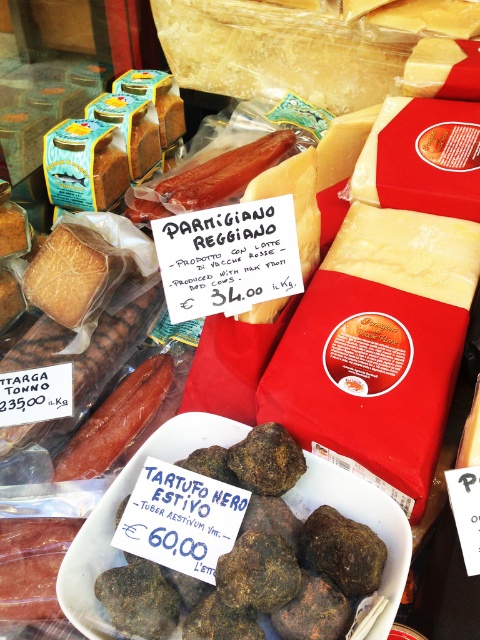
Is point (311, 620) positioned in front of point (93, 445)?

Yes, it is.

Is point (163, 612) closer to camera compared to point (121, 385)?

Yes, point (163, 612) is closer to viewer.

Find the location of a particular element. The width and height of the screenshot is (480, 640). brown rough truffle at lower center is located at coordinates (251, 561).

Does brown rough truffle at lower center have a greater height compared to smoked pinkish-red meat at center?

No.

The image size is (480, 640). I want to click on brown rough truffle at lower center, so click(x=251, y=561).

Does red-brown cured meat at center-left have a lesser width compared to smoked pinkish-red meat at center?

Correct, red-brown cured meat at center-left's width is less than smoked pinkish-red meat at center's.

Which is below, red-brown cured meat at center-left or smoked pinkish-red meat at center?

red-brown cured meat at center-left is lower down.

Between point (72, 440) and point (265, 134), which one is positioned in front?

Positioned in front is point (72, 440).

Locate an element on the screen. red-brown cured meat at center-left is located at coordinates (117, 420).